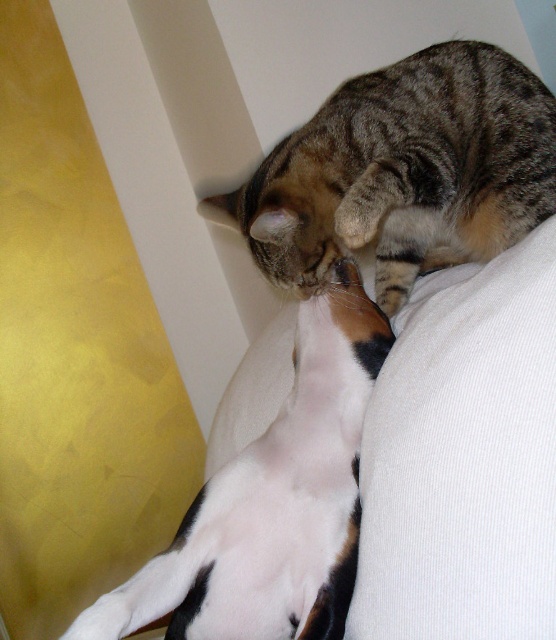
You are taking a photo of two cats in a cozy domestic scene. You want to focus on the cat at point (460, 241) and the cat at point (320, 492). Which cat is closer to your camera?

The cat at point (460, 241) is closer to the camera than the cat at point (320, 492) because point (460, 241) is further to the camera than point (320, 492).

You are a photographer trying to capture a closeup of the tabby fur cat at upper center and the white fur cat at center. Since the camera can only focus on one cat at a time, which cat should you focus on if you want the one that is higher in the image?

The tabby fur cat at upper center is above the white fur cat at center, so you should focus on the tabby fur cat at upper center to capture the one that is higher in the image.

You are a photographer trying to capture both the tabby fur cat at upper center and the white fur cat at center in a single shot. Based on their heights, which cat will appear smaller in the photo?

The tabby fur cat at upper center will appear smaller in the photo because it has a lesser height compared to the white fur cat at center.